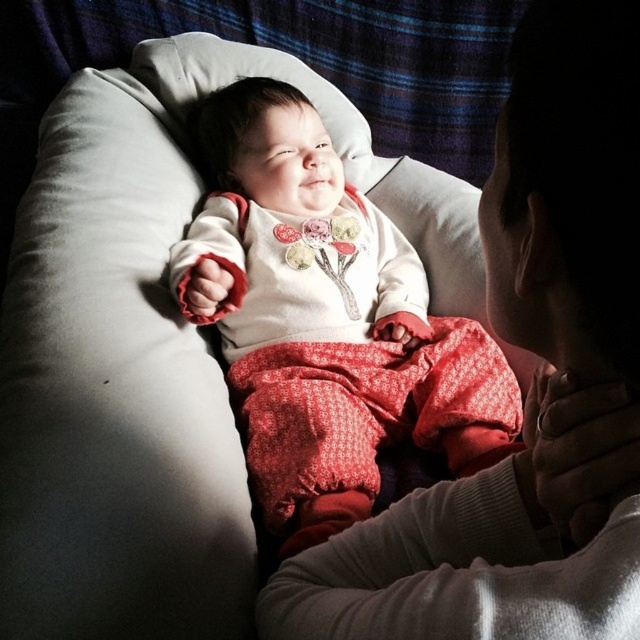
Is point (602, 152) positioned after point (280, 232)?

No, (602, 152) is in front of (280, 232).

Who is shorter, white soft fabric at upper center or white soft fabric baby at center?

With less height is white soft fabric at upper center.

Between point (438, 488) and point (378, 241), which one is positioned in front?

Point (438, 488) is more forward.

You are a GUI agent. You are given a task and a screenshot of the screen. Output one action in this format:
    pyautogui.click(x=<x>, y=<y>)
    Task: Click on the white soft fabric at upper center
    
    Given the screenshot: What is the action you would take?
    pyautogui.click(x=531, y=390)